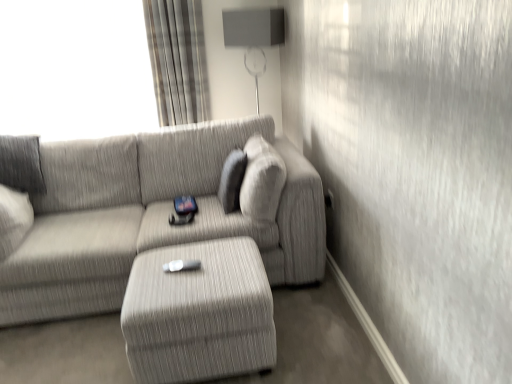
The image size is (512, 384). Describe the element at coordinates (177, 60) in the screenshot. I see `plaid fabric curtain at upper left` at that location.

In order to face textured gray couch at center, should I rotate leftwards or rightwards?

You should look left and rotate roughly 15.371 degrees.

The height and width of the screenshot is (384, 512). What are the coordinates of `matte gray lampshade at upper center` in the screenshot? It's located at (254, 37).

Considering the relative positions of white matte wii controller at center and plaid fabric curtain at upper left in the image provided, is white matte wii controller at center in front of plaid fabric curtain at upper left?

Yes, white matte wii controller at center is closer to the viewer.

Can you confirm if white matte wii controller at center is bigger than plaid fabric curtain at upper left?

Actually, white matte wii controller at center might be smaller than plaid fabric curtain at upper left.

Does white matte wii controller at center have a greater width compared to plaid fabric curtain at upper left?

No.

Considering the sizes of objects white matte wii controller at center and plaid fabric curtain at upper left in the image provided, who is taller, white matte wii controller at center or plaid fabric curtain at upper left?

With more height is plaid fabric curtain at upper left.

Is the position of textured gray ottoman at center more distant than that of white matte wii controller at center?

No, it is in front of white matte wii controller at center.

Can you confirm if textured gray ottoman at center is taller than white matte wii controller at center?

Indeed, textured gray ottoman at center has a greater height compared to white matte wii controller at center.

Who is smaller, textured gray ottoman at center or white matte wii controller at center?

white matte wii controller at center is smaller.

Is white matte wii controller at center not close to matte gray lampshade at upper center?

white matte wii controller at center is far away from matte gray lampshade at upper center.

Considering the positions of objects white matte wii controller at center and matte gray lampshade at upper center in the image provided, who is in front, white matte wii controller at center or matte gray lampshade at upper center?

white matte wii controller at center is closer to the camera.

Where is `lamp above the white matte wii controller at center (from a real-world perspective)`? The width and height of the screenshot is (512, 384). lamp above the white matte wii controller at center (from a real-world perspective) is located at coordinates (254, 37).

Considering the points (189, 267) and (265, 57), which point is behind, point (189, 267) or point (265, 57)?

Point (265, 57)

Which point is more distant from viewer, (34, 196) or (245, 292)?

The point (34, 196) is behind.

Is textured gray couch at center touching textured gray ottoman at center?

textured gray couch at center is not next to textured gray ottoman at center, and they're not touching.

From the image's perspective, is textured gray couch at center positioned above or below textured gray ottoman at center?

textured gray couch at center is above textured gray ottoman at center.

Considering the sizes of objects textured gray ottoman at center and plaid fabric curtain at upper left in the image provided, who is thinner, textured gray ottoman at center or plaid fabric curtain at upper left?

plaid fabric curtain at upper left is thinner.

From the image's perspective, which one is positioned lower, textured gray ottoman at center or plaid fabric curtain at upper left?

textured gray ottoman at center.

At what (x,y) coordinates should I click in order to perform the action: click on table directly beneath the plaid fabric curtain at upper left (from a real-world perspective). Please return your answer as a coordinate pair (x, y). Looking at the image, I should click on coord(199,314).

From a real-world perspective, which object rests below the other?

textured gray ottoman at center is physically lower.

Considering the positions of objects textured gray ottoman at center and textured gray couch at center in the image provided, who is more to the left, textured gray ottoman at center or textured gray couch at center?

Positioned to the left is textured gray couch at center.

From a real-world perspective, is textured gray ottoman at center positioned above or below textured gray couch at center?

Clearly, from a real-world perspective, textured gray ottoman at center is below textured gray couch at center.

Where is `table below the textured gray couch at center (from a real-world perspective)`? The width and height of the screenshot is (512, 384). table below the textured gray couch at center (from a real-world perspective) is located at coordinates (199, 314).

Is textured gray couch at center located within textured gray ottoman at center?

No, textured gray couch at center is not surrounded by textured gray ottoman at center.

Is matte gray lampshade at upper center in contact with plaid fabric curtain at upper left?

No.

Does matte gray lampshade at upper center have a lesser width compared to plaid fabric curtain at upper left?

No.

Is plaid fabric curtain at upper left a part of matte gray lampshade at upper center?

No, plaid fabric curtain at upper left is located outside of matte gray lampshade at upper center.

Can you confirm if matte gray lampshade at upper center is positioned to the right of plaid fabric curtain at upper left?

Yes, matte gray lampshade at upper center is to the right of plaid fabric curtain at upper left.

Where is `Wii controller that is below the plaid fabric curtain at upper left (from the image's perspective)`? This screenshot has height=384, width=512. Wii controller that is below the plaid fabric curtain at upper left (from the image's perspective) is located at coordinates (182, 266).

Identify the location of Wii controller positioned vertically above the textured gray ottoman at center (from a real-world perspective). (182, 266).

Which object lies nearer to the anchor point plaid fabric curtain at upper left, textured gray ottoman at center or textured gray couch at center?

textured gray couch at center lies closer to plaid fabric curtain at upper left than the other object.

Considering their positions, is matte gray lampshade at upper center positioned further to white matte wii controller at center than textured gray ottoman at center?

matte gray lampshade at upper center is further to white matte wii controller at center.

From the image, which object appears to be farther from textured gray couch at center, matte gray lampshade at upper center or textured gray ottoman at center?

The object further to textured gray couch at center is matte gray lampshade at upper center.

Estimate the real-world distances between objects in this image. Which object is further from textured gray couch at center, matte gray lampshade at upper center or plaid fabric curtain at upper left?

matte gray lampshade at upper center is further to textured gray couch at center.

From the image, which object appears to be farther from textured gray ottoman at center, white matte wii controller at center or matte gray lampshade at upper center?

matte gray lampshade at upper center is further to textured gray ottoman at center.

Looking at the image, which one is located closer to white matte wii controller at center, plaid fabric curtain at upper left or matte gray lampshade at upper center?

plaid fabric curtain at upper left is positioned closer to the anchor white matte wii controller at center.

When comparing their distances from plaid fabric curtain at upper left, does textured gray couch at center or textured gray ottoman at center seem closer?

The object closer to plaid fabric curtain at upper left is textured gray couch at center.

Based on their spatial positions, is matte gray lampshade at upper center or plaid fabric curtain at upper left further from textured gray ottoman at center?

matte gray lampshade at upper center is further to textured gray ottoman at center.

I want to click on Wii controller between plaid fabric curtain at upper left and textured gray ottoman at center from top to bottom, so click(182, 266).

This screenshot has height=384, width=512. I want to click on lamp located between textured gray couch at center and plaid fabric curtain at upper left in the depth direction, so click(x=254, y=37).

Locate an element on the screen. Wii controller located between textured gray couch at center and textured gray ottoman at center in the left-right direction is located at coordinates (182, 266).

Where is `Wii controller between matte gray lampshade at upper center and textured gray ottoman at center in the vertical direction`? Wii controller between matte gray lampshade at upper center and textured gray ottoman at center in the vertical direction is located at coordinates (182, 266).